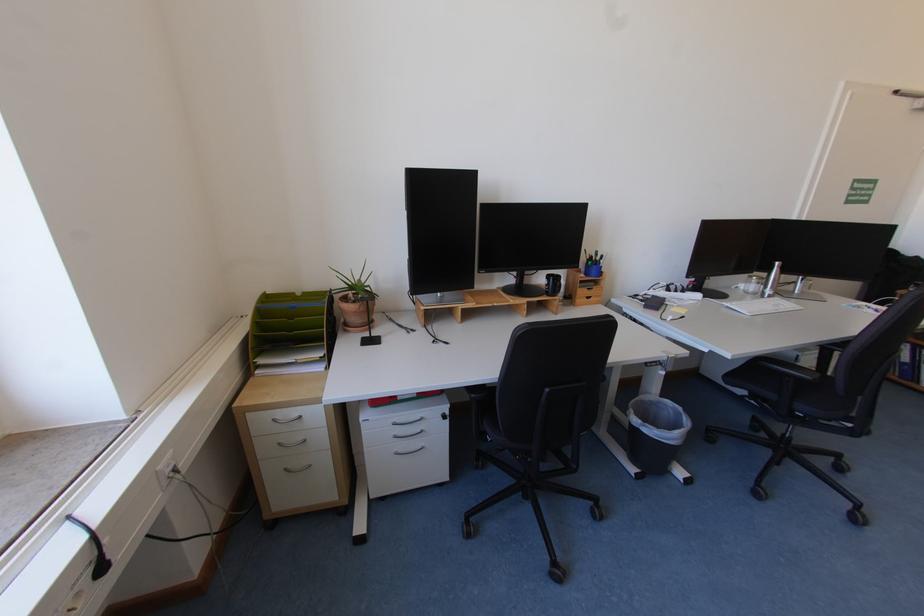
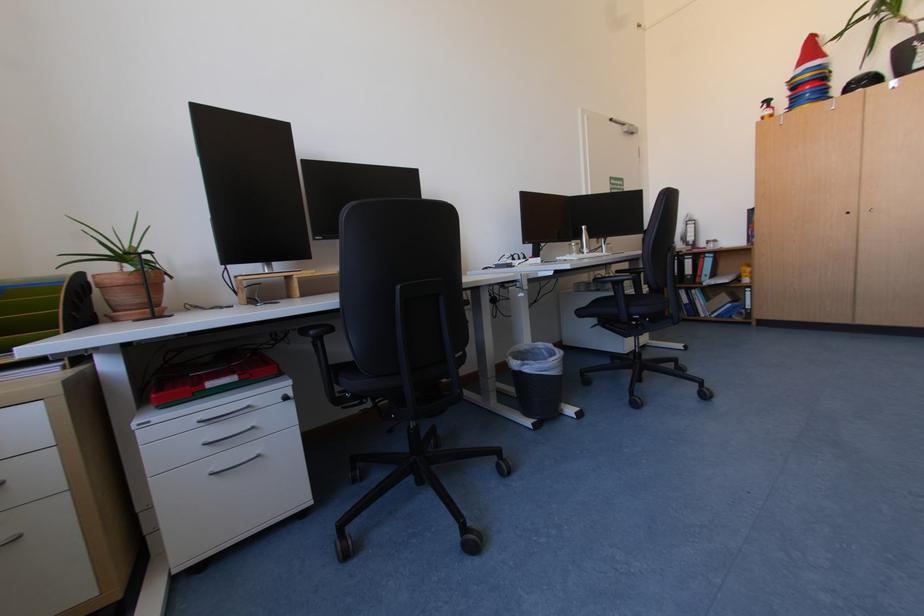
The images are taken continuously from a first-person perspective. In which direction are you moving?

The cameraman moved toward right, forward.